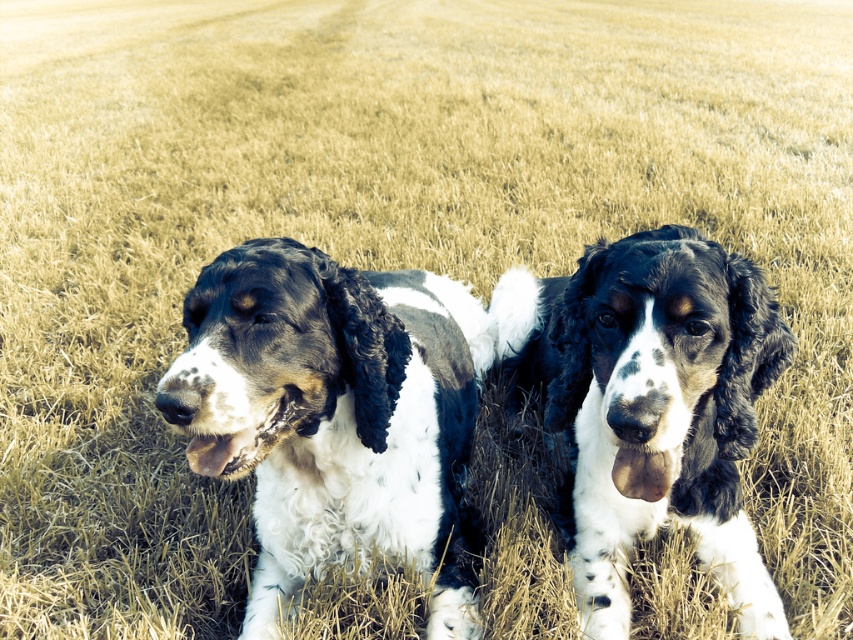
You are a photographer trying to capture the perfect shot of the black and white fur dog at center. To ensure the dog is in the center of your photo, should you move the camera to the left or right?

The black and white fur dog at center is already at point 0.647 on the x axis, which is slightly to the right of the center point. To center it, you should move the camera to the left.

You are a photographer trying to capture a photo of both dogs. Since you want to ensure the black and white fur dog at center and the spotted fur dog at center are both in the frame, can you determine which dog is on the left side?

The black and white fur dog at center is positioned on the left side of the spotted fur dog at center, so the black and white fur dog at center is on the left.